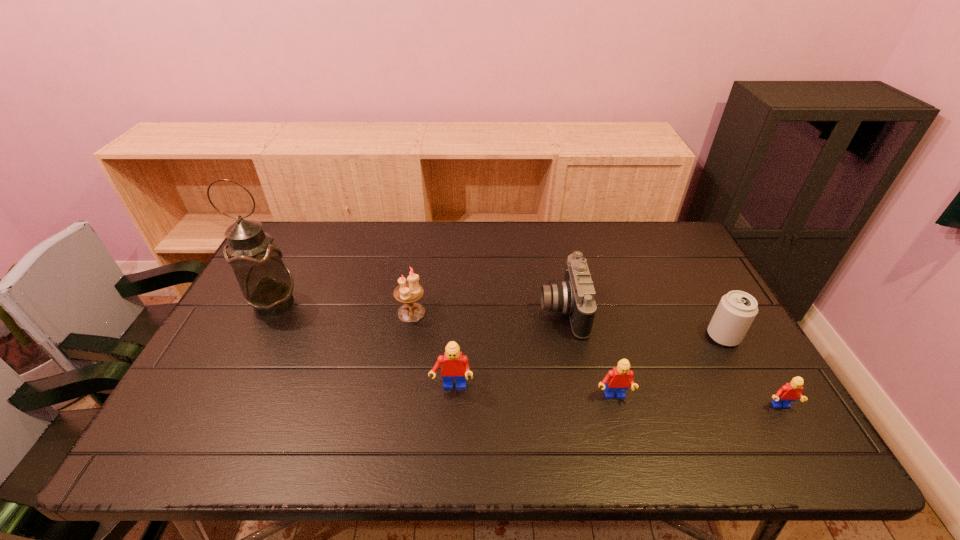
Where is `the tallest Lego`? The width and height of the screenshot is (960, 540). the tallest Lego is located at coordinates (455, 365).

Locate an element on the screen. The width and height of the screenshot is (960, 540). the fifth object from right to left is located at coordinates (455, 365).

You are a GUI agent. You are given a task and a screenshot of the screen. Output one action in this format:
    pyautogui.click(x=<x>, y=<y>)
    Task: Click on the second shortest Lego
    The width and height of the screenshot is (960, 540).
    Given the screenshot: What is the action you would take?
    pyautogui.click(x=618, y=379)

Locate an element on the screen. Image resolution: width=960 pixels, height=540 pixels. the shortest Lego is located at coordinates (791, 391).

Identify the location of the rightmost Lego. (791, 391).

Where is `can`? The width and height of the screenshot is (960, 540). can is located at coordinates (736, 310).

Identify the location of camera. (575, 296).

Image resolution: width=960 pixels, height=540 pixels. I want to click on the sixth object from right to left, so click(x=410, y=292).

Where is `oil lamp`? oil lamp is located at coordinates (266, 282).

Locate an element on the screen. This screenshot has height=540, width=960. the leftmost object is located at coordinates (266, 282).